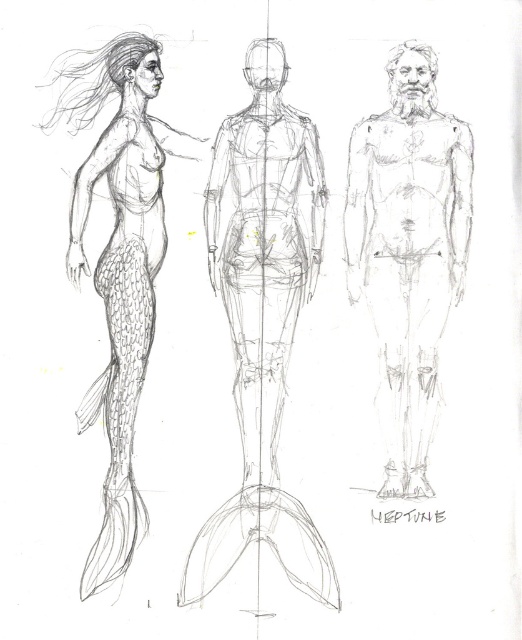
Consider the image. You are an art student analyzing the sketch. You notice two points marked in the image. The first point is at coordinate point [210,564] and the second is at coordinate point [433,381]. Which of these points is positioned closer to the viewer in the sketch?

Point [210,564] is closer to the viewer than point [433,381].

You are an art student analyzing this sketch. You want to place a sticker on the closest object to the viewer between the smooth pencil sketch of humanoid figure at center and the smooth gray tail at left. Which object should you choose?

The smooth pencil sketch of humanoid figure at center is closer to the viewer than the smooth gray tail at left, so you should place the sticker on the smooth pencil sketch of humanoid figure at center.

From the picture: You are an artist analyzing the sketch. You notice a point at coordinates (262,310). Based on the scene description, which figure does this point correspond to?

The point at coordinates (262,310) corresponds to the smooth pencil sketch of humanoid figure at center.